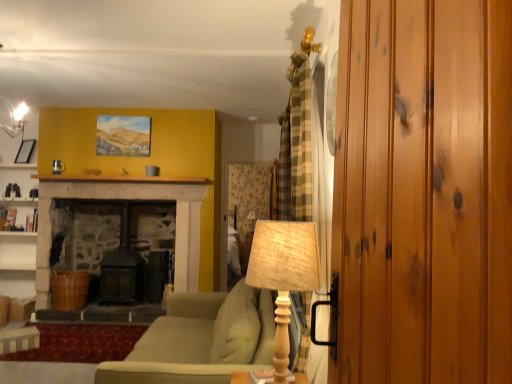
Question: Can you confirm if glossy wood wardrobe at right is wider than matte black picture frame at upper left?

Choices:
 (A) no
 (B) yes

Answer: (A)

Question: From a real-world perspective, is glossy wood wardrobe at right physically below matte black picture frame at upper left?

Choices:
 (A) yes
 (B) no

Answer: (A)

Question: Considering the relative sizes of glossy wood wardrobe at right and matte black picture frame at upper left in the image provided, is glossy wood wardrobe at right shorter than matte black picture frame at upper left?

Choices:
 (A) yes
 (B) no

Answer: (B)

Question: Does glossy wood wardrobe at right touch matte black picture frame at upper left?

Choices:
 (A) no
 (B) yes

Answer: (A)

Question: From the image's perspective, does glossy wood wardrobe at right appear lower than matte black picture frame at upper left?

Choices:
 (A) yes
 (B) no

Answer: (A)

Question: From the image's perspective, does glossy wood wardrobe at right appear higher than matte black picture frame at upper left?

Choices:
 (A) yes
 (B) no

Answer: (B)

Question: Is matte black picture frame at upper left touching glossy wood wardrobe at right?

Choices:
 (A) no
 (B) yes

Answer: (A)

Question: Is glossy wood wardrobe at right inside matte black picture frame at upper left?

Choices:
 (A) no
 (B) yes

Answer: (A)

Question: Is matte black picture frame at upper left at the left side of glossy wood wardrobe at right?

Choices:
 (A) no
 (B) yes

Answer: (B)

Question: Is matte black picture frame at upper left located outside glossy wood wardrobe at right?

Choices:
 (A) no
 (B) yes

Answer: (B)

Question: Is the position of matte black picture frame at upper left more distant than that of glossy wood wardrobe at right?

Choices:
 (A) yes
 (B) no

Answer: (A)

Question: From a real-world perspective, is matte black picture frame at upper left on top of glossy wood wardrobe at right?

Choices:
 (A) no
 (B) yes

Answer: (B)

Question: Is the position of matte stone fireplace at upper center more distant than that of wooden textured table lamp at center, the 2th table lamp viewed from the back?

Choices:
 (A) no
 (B) yes

Answer: (B)